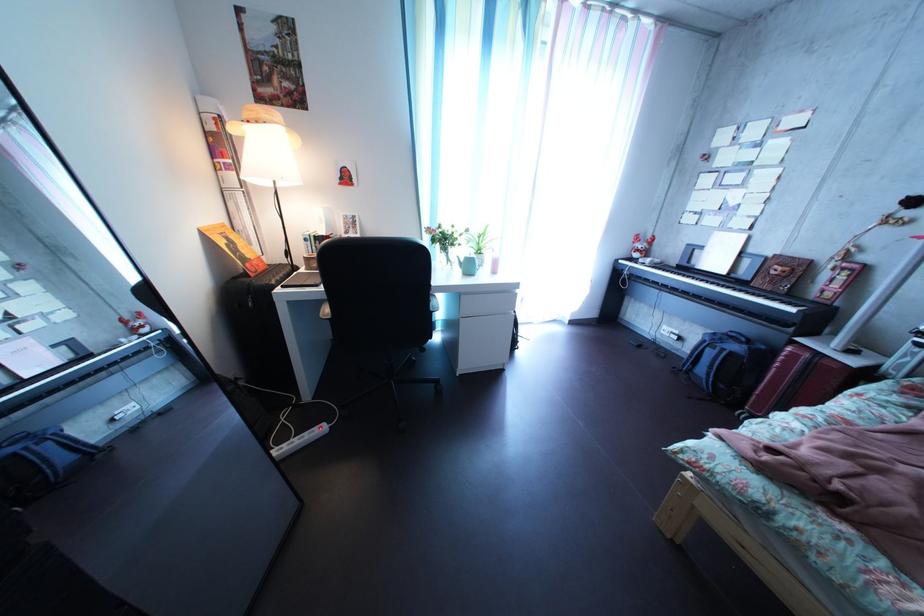
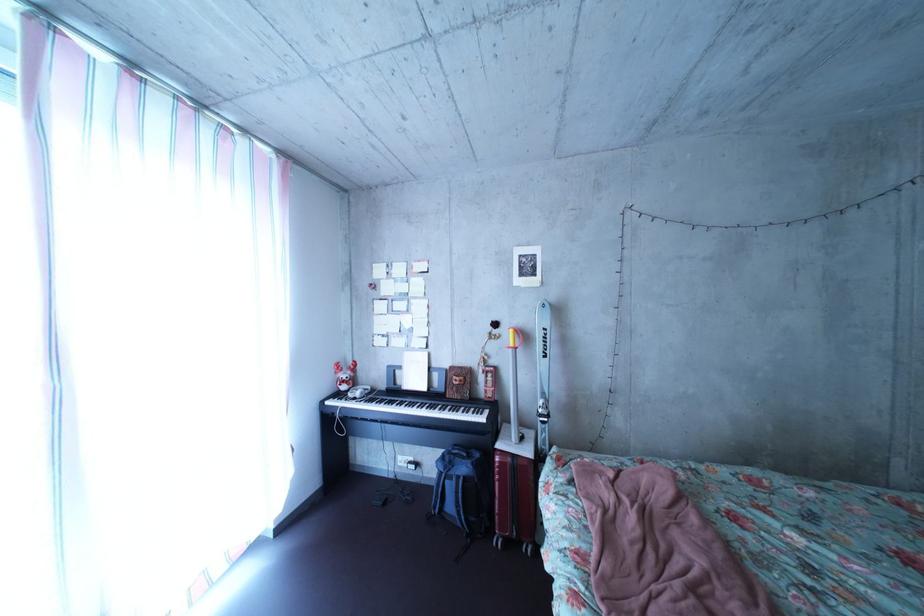
The point at (749, 355) is marked in the first image. Where is the corresponding point in the second image?

(479, 477)